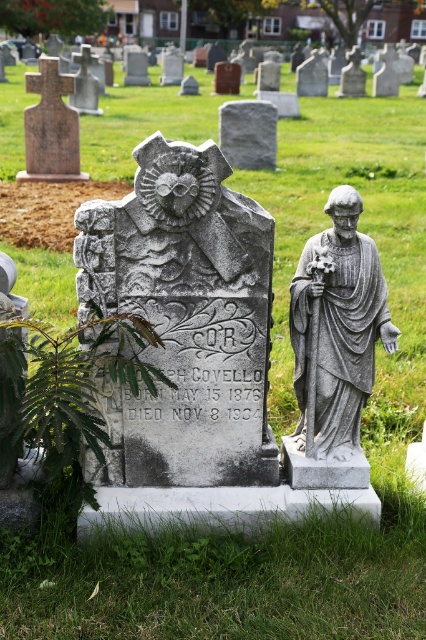
Question: Is gray stone owl at center thinner than gray stone gravestone at center?

Choices:
 (A) no
 (B) yes

Answer: (B)

Question: Is gray stone owl at center in front of gray stone statue at right?

Choices:
 (A) yes
 (B) no

Answer: (A)

Question: Which point is farther from the camera taking this photo?

Choices:
 (A) (252, 116)
 (B) (345, 426)
 (C) (149, 200)

Answer: (A)

Question: Estimate the real-world distances between objects in this image. Which object is closer to the gray stone owl at center?

Choices:
 (A) gray stone gravestone at center
 (B) gray stone statue at right

Answer: (B)

Question: Is gray stone owl at center positioned before gray stone statue at right?

Choices:
 (A) no
 (B) yes

Answer: (B)

Question: Which point is farther to the camera?

Choices:
 (A) (302, 424)
 (B) (264, 102)
 (C) (212, 196)

Answer: (B)